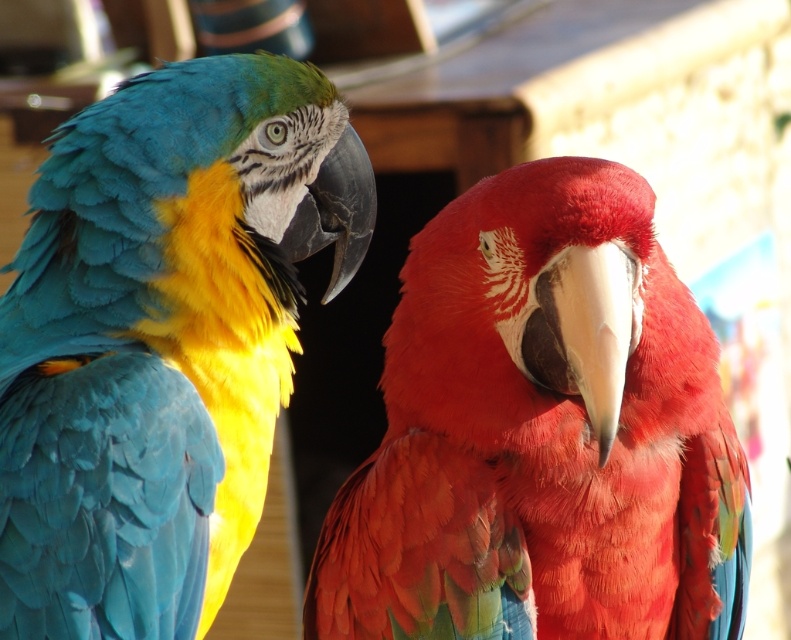
Does shiny red parrot at center have a larger size compared to shiny blue feathers at left?

No, shiny red parrot at center is not bigger than shiny blue feathers at left.

Between shiny red parrot at center and shiny blue feathers at left, which one is positioned lower?

shiny red parrot at center is below.

Is point (634, 628) less distant than point (190, 348)?

Yes, point (634, 628) is closer to viewer.

Where is `shiny red parrot at center`? This screenshot has width=791, height=640. shiny red parrot at center is located at coordinates (542, 433).